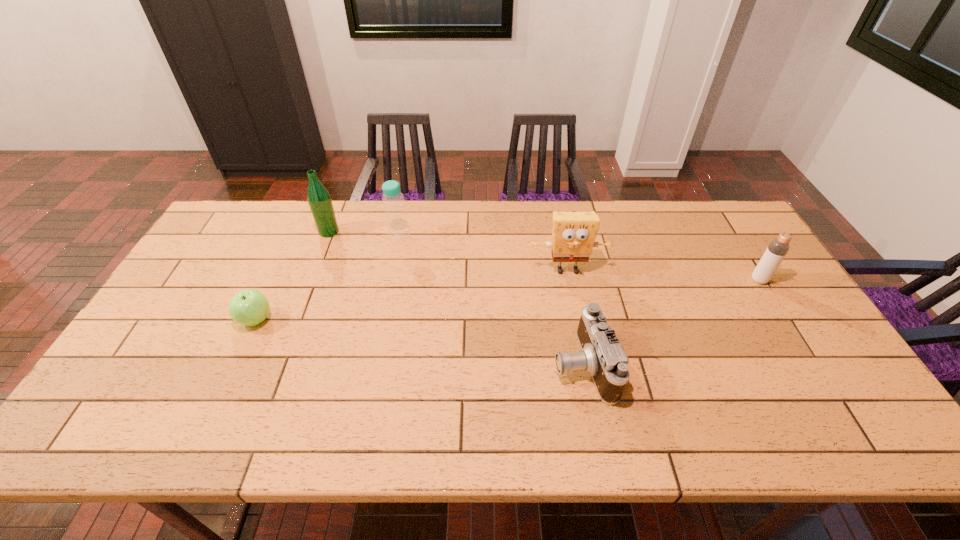
Find the location of a particular element. The image size is (960, 540). free spot located 0.350m on the face of the sponge is located at coordinates (590, 383).

Where is `free spot located on the back of the rightmost object`? free spot located on the back of the rightmost object is located at coordinates (730, 233).

Identify the location of free spot located at the lens of the camera. The width and height of the screenshot is (960, 540). click(513, 364).

Find the location of `vacant space located 0.230m at the lens of the camera`. vacant space located 0.230m at the lens of the camera is located at coordinates (462, 364).

The height and width of the screenshot is (540, 960). Identify the location of vacant area situated at the lens of the camera. (482, 364).

Image resolution: width=960 pixels, height=540 pixels. Find the location of `blank space located 0.330m on the right of the apple`. blank space located 0.330m on the right of the apple is located at coordinates (393, 320).

I want to click on object that is at the right edge, so click(x=776, y=251).

You are a GUI agent. You are given a task and a screenshot of the screen. Output one action in this format:
    pyautogui.click(x=<x>, y=<y>)
    Task: Click on the vacant space at the far edge of the desktop
    The image size is (960, 540).
    Given the screenshot: What is the action you would take?
    pyautogui.click(x=493, y=228)

Image resolution: width=960 pixels, height=540 pixels. What are the coordinates of `vacant region at the left edge` in the screenshot? It's located at (186, 280).

Where is `vacant space at the right edge of the desktop`? This screenshot has width=960, height=540. vacant space at the right edge of the desktop is located at coordinates (781, 380).